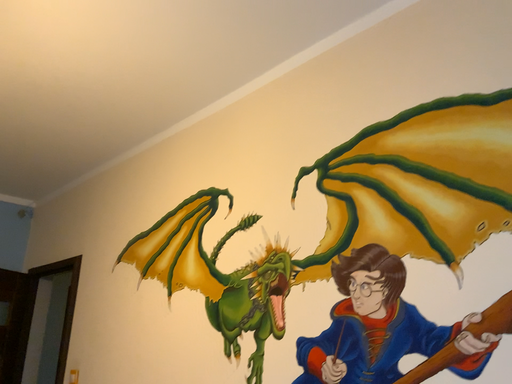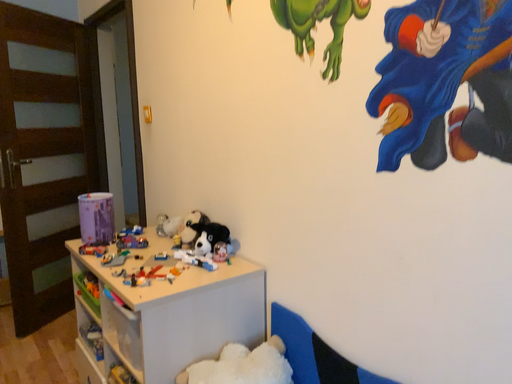
Question: Which way did the camera rotate in the video?

Choices:
 (A) rotated upward
 (B) rotated downward

Answer: (B)